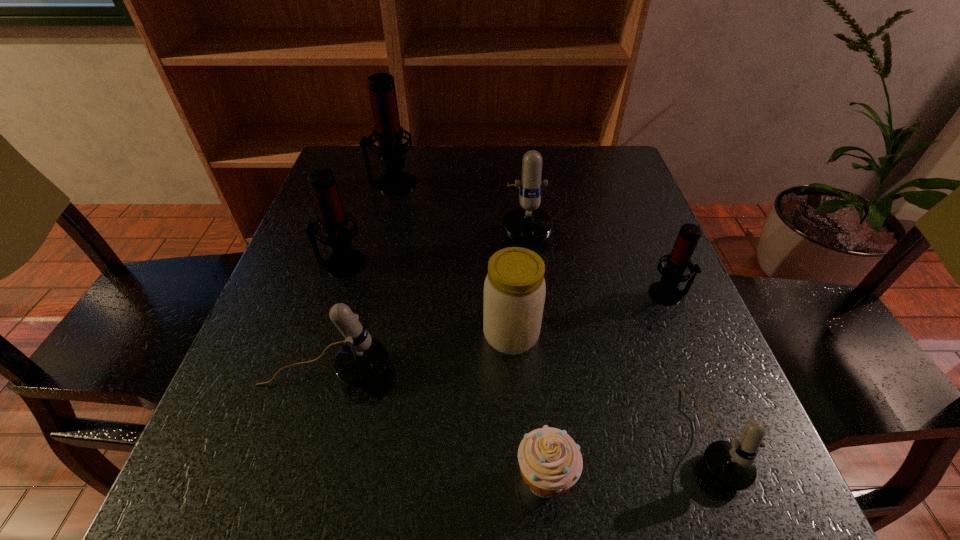
Choose which microphone is the fifth nearest neighbor to the smallest red microphone. Please provide its 2D coordinates. Your answer should be formatted as a tuple, i.e. [(x, y)], where the tuple contains the x and y coordinates of a point satisfying the conditions above.

[(388, 132)]

Choose which red microphone is the third nearest neighbor to the rightmost white microphone. Please provide its 2D coordinates. Your answer should be formatted as a tuple, i.e. [(x, y)], where the tuple contains the x and y coordinates of a point satisfying the conditions above.

[(388, 132)]

Locate an element on the screen. Image resolution: width=960 pixels, height=540 pixels. red microphone object that ranks as the closest to the third nearest microphone is located at coordinates (344, 261).

You are a GUI agent. You are given a task and a screenshot of the screen. Output one action in this format:
    pyautogui.click(x=<x>, y=<y>)
    Task: Click on the white microphone that is the second closest one to the second biggest red microphone
    The height and width of the screenshot is (540, 960).
    Given the screenshot: What is the action you would take?
    pyautogui.click(x=527, y=224)

This screenshot has width=960, height=540. Find the location of `white microphone that stands as the second closest to the fourth farthest microphone`. white microphone that stands as the second closest to the fourth farthest microphone is located at coordinates (527, 224).

Locate an element on the screen. free point that satisfies the following two spatial constraints: 1. on the back side of the leftmost white microphone; 2. on the right side of the fourth farthest object is located at coordinates (349, 294).